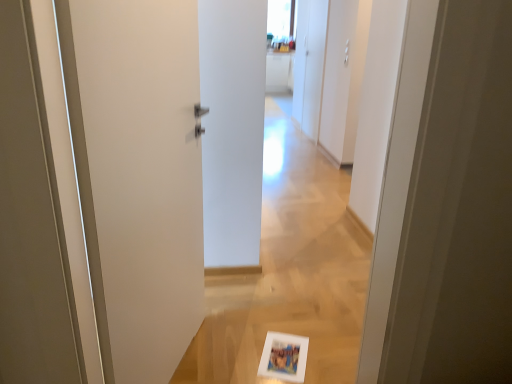
Image resolution: width=512 pixels, height=384 pixels. I want to click on white matte cabinet at upper right, so click(x=314, y=67).

This screenshot has width=512, height=384. What do you see at coordinates (314, 67) in the screenshot?
I see `white matte cabinet at upper right` at bounding box center [314, 67].

Identify the location of white matte door at left. Image resolution: width=512 pixels, height=384 pixels. (138, 175).

The image size is (512, 384). Describe the element at coordinates (138, 175) in the screenshot. I see `white matte door at left` at that location.

Locate an element on the screen. Image resolution: width=512 pixels, height=384 pixels. white matte cabinet at upper right is located at coordinates (314, 67).

Is white matte door at left at the left side of white matte cabinet at upper right?

Yes, white matte door at left is to the left of white matte cabinet at upper right.

In the image, is white matte door at left positioned in front of or behind white matte cabinet at upper right?

Visually, white matte door at left is located in front of white matte cabinet at upper right.

Does point (108, 371) come farther from viewer compared to point (314, 136)?

No, (108, 371) is closer to viewer.

From the picture: From the image's perspective, would you say white matte door at left is shown under white matte cabinet at upper right?

Yes, from the image's perspective, white matte door at left is beneath white matte cabinet at upper right.

From a real-world perspective, which is physically below, white matte door at left or white matte cabinet at upper right?

From a 3D spatial view, white matte door at left is below.

Considering the relative sizes of white matte door at left and white matte cabinet at upper right in the image provided, is white matte door at left wider than white matte cabinet at upper right?

Correct, the width of white matte door at left exceeds that of white matte cabinet at upper right.

Considering the sizes of white matte door at left and white matte cabinet at upper right in the image, is white matte door at left taller or shorter than white matte cabinet at upper right?

Clearly, white matte door at left is shorter compared to white matte cabinet at upper right.

Who is bigger, white matte door at left or white matte cabinet at upper right?

white matte cabinet at upper right is bigger.

Is white matte door at left not inside white matte cabinet at upper right?

That's correct, white matte door at left is outside of white matte cabinet at upper right.

Looking at this image, is white matte door at left touching white matte cabinet at upper right?

There is a gap between white matte door at left and white matte cabinet at upper right.

Is white matte cabinet at upper right at the back of white matte door at left?

No, white matte cabinet at upper right is not at the back of white matte door at left.

Measure the distance from white matte door at left to white matte cabinet at upper right.

A distance of 4.14 meters exists between white matte door at left and white matte cabinet at upper right.

This screenshot has height=384, width=512. In order to click on door in front of the white matte cabinet at upper right in this screenshot , I will do `click(138, 175)`.

Is white matte cabinet at upper right to the right of white matte door at left from the viewer's perspective?

Correct, you'll find white matte cabinet at upper right to the right of white matte door at left.

Between white matte cabinet at upper right and white matte door at left, which one is positioned in front?

white matte door at left.

Which is closer, (313, 33) or (112, 346)?

Point (313, 33).

From the image's perspective, is white matte cabinet at upper right over white matte door at left?

Yes, from the image's perspective, white matte cabinet at upper right is on top of white matte door at left.

From a real-world perspective, is white matte cabinet at upper right over white matte door at left?

Yes, from a real-world perspective, white matte cabinet at upper right is on top of white matte door at left.

Considering the sizes of objects white matte cabinet at upper right and white matte door at left in the image provided, who is thinner, white matte cabinet at upper right or white matte door at left?

white matte cabinet at upper right.

In terms of height, does white matte cabinet at upper right look taller or shorter compared to white matte door at left?

In the image, white matte cabinet at upper right appears to be taller than white matte door at left.

Considering the relative sizes of white matte cabinet at upper right and white matte door at left in the image provided, is white matte cabinet at upper right smaller than white matte door at left?

Actually, white matte cabinet at upper right might be larger than white matte door at left.

Based on the photo, would you say white matte cabinet at upper right is outside white matte door at left?

That's correct, white matte cabinet at upper right is outside of white matte door at left.

Are white matte cabinet at upper right and white matte door at left making contact?

white matte cabinet at upper right and white matte door at left are clearly separated.

Is white matte cabinet at upper right facing towards white matte door at left?

No, white matte cabinet at upper right is not oriented towards white matte door at left.

How many degrees apart are the facing directions of white matte cabinet at upper right and white matte door at left?

160 degrees.

Looking at this image, how far apart are white matte cabinet at upper right and white matte door at left?

A distance of 13.57 feet exists between white matte cabinet at upper right and white matte door at left.

Identify the location of screen door behind the white matte door at left. The height and width of the screenshot is (384, 512). (314, 67).

Where is `screen door behind the white matte door at left`? This screenshot has height=384, width=512. screen door behind the white matte door at left is located at coordinates (314, 67).

Find the location of a particular element. This screenshot has height=384, width=512. door located on the left of white matte cabinet at upper right is located at coordinates (138, 175).